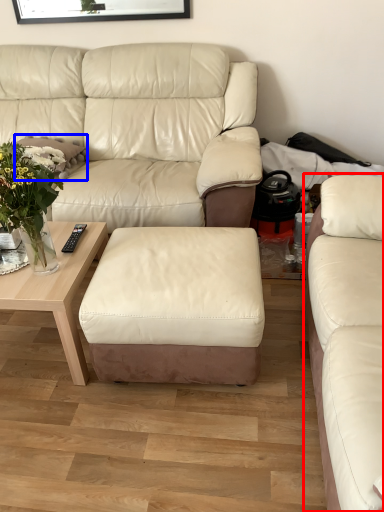
Question: Which point is further to the camera, studio couch (highlighted by a red box) or pillow (highlighted by a blue box)?

Choices:
 (A) studio couch
 (B) pillow

Answer: (B)